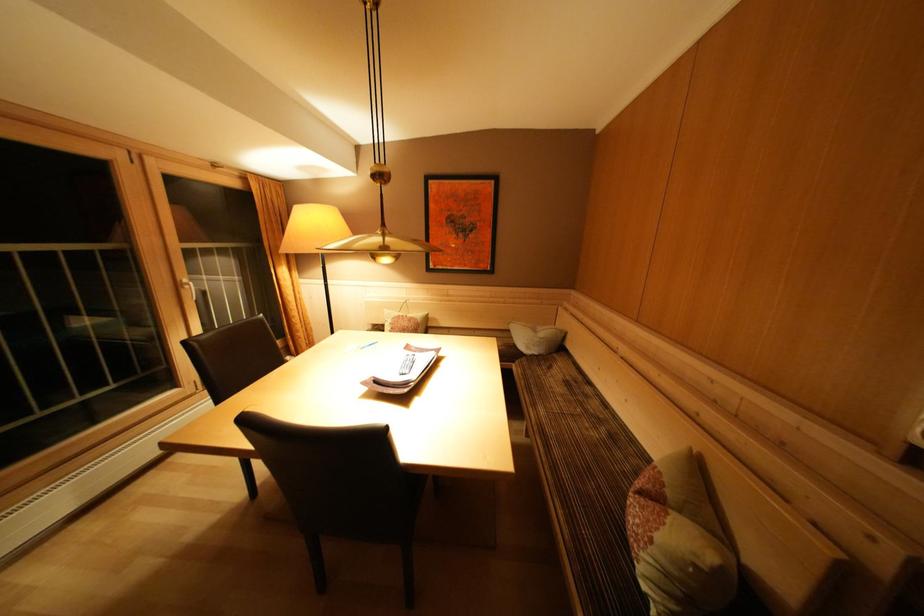
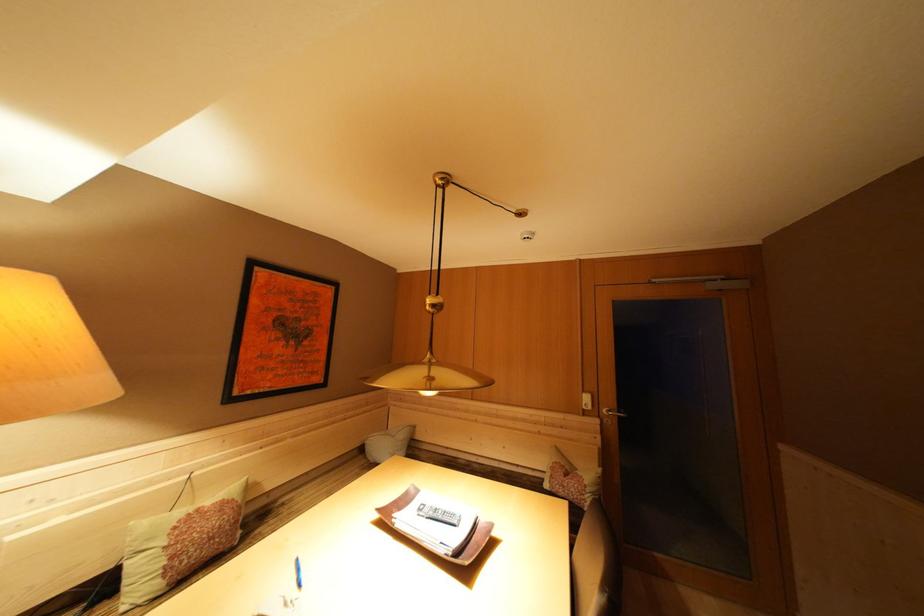
In the second image, find the point that corresponds to pixel 549 339 in the first image.

(408, 440)